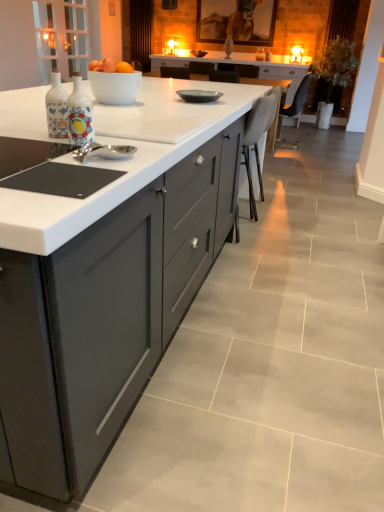
Question: Is matte gray cabinetry at center further to the viewer compared to decorative ceramic bottle at center-left?

Choices:
 (A) no
 (B) yes

Answer: (A)

Question: Is matte gray cabinetry at center at the right side of decorative ceramic bottle at center-left?

Choices:
 (A) yes
 (B) no

Answer: (B)

Question: Would you say matte gray cabinetry at center is a long distance from decorative ceramic bottle at center-left?

Choices:
 (A) yes
 (B) no

Answer: (B)

Question: From the image's perspective, is matte gray cabinetry at center below decorative ceramic bottle at center-left?

Choices:
 (A) no
 (B) yes

Answer: (B)

Question: Can you confirm if matte gray cabinetry at center is shorter than decorative ceramic bottle at center-left?

Choices:
 (A) yes
 (B) no

Answer: (B)

Question: Does matte gray cabinetry at center have a greater height compared to decorative ceramic bottle at center-left?

Choices:
 (A) no
 (B) yes

Answer: (B)

Question: Does dark brown leather chair at upper right, arranged as the second chair when viewed from the front, have a lesser width compared to matte gray cabinetry at center?

Choices:
 (A) no
 (B) yes

Answer: (B)

Question: Considering the relative positions of dark brown leather chair at upper right, arranged as the 1th chair when viewed from the top, and matte gray cabinetry at center in the image provided, is dark brown leather chair at upper right, arranged as the 1th chair when viewed from the top, to the left of matte gray cabinetry at center from the viewer's perspective?

Choices:
 (A) yes
 (B) no

Answer: (B)

Question: Is dark brown leather chair at upper right, arranged as the 1th chair when viewed from the top, at the right side of matte gray cabinetry at center?

Choices:
 (A) yes
 (B) no

Answer: (A)

Question: Is matte gray cabinetry at center at the back of dark brown leather chair at upper right, acting as the 1th chair starting from the right?

Choices:
 (A) no
 (B) yes

Answer: (A)

Question: Does dark brown leather chair at upper right, which is the second chair from bottom to top, come in front of matte gray cabinetry at center?

Choices:
 (A) no
 (B) yes

Answer: (A)

Question: Does dark brown leather chair at upper right, which is the second chair from bottom to top, lie behind matte gray cabinetry at center?

Choices:
 (A) yes
 (B) no

Answer: (A)

Question: Does white leather chair at center, which appears as the 2th chair when viewed from the back, have a greater height compared to matte gray plate at center?

Choices:
 (A) yes
 (B) no

Answer: (A)